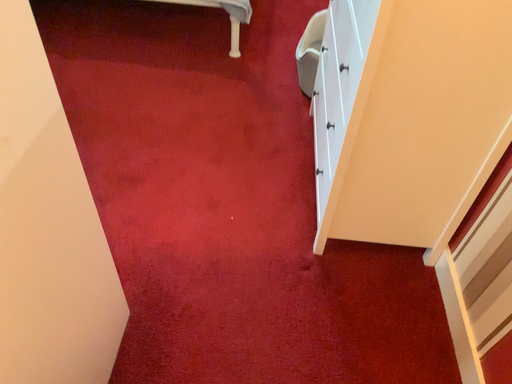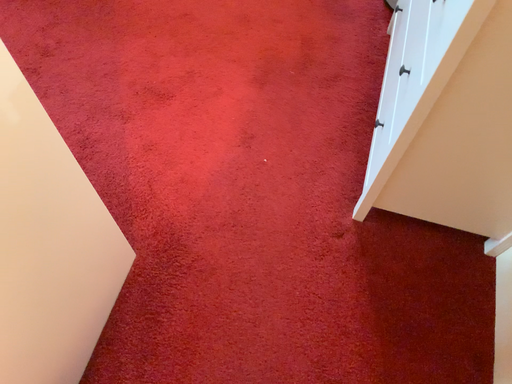
Question: Which way did the camera rotate in the video?

Choices:
 (A) rotated downward
 (B) rotated upward

Answer: (A)